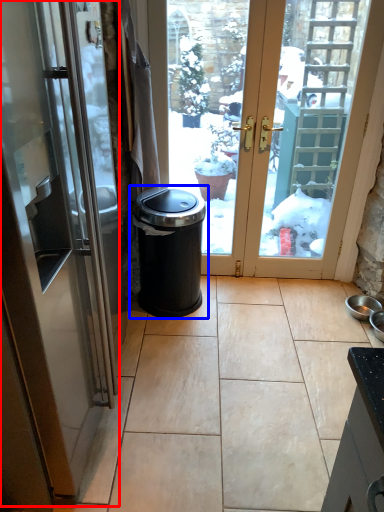
Question: Which point is further to the camera, door (highlighted by a red box) or waste container (highlighted by a blue box)?

Choices:
 (A) door
 (B) waste container

Answer: (B)